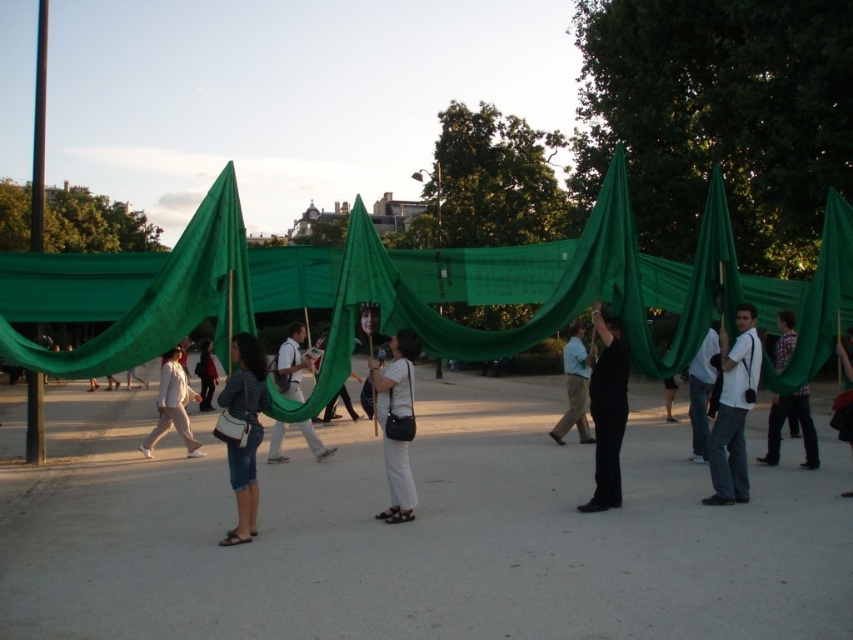
Is point (780, 362) farther from viewer compared to point (675, 420)?

That is False.

Can you confirm if plaid shirt at center is smaller than black fabric at center?

Correct, plaid shirt at center occupies less space than black fabric at center.

Is point (787, 339) more distant than point (671, 374)?

Yes.

Find the location of `plaid shirt at center`. plaid shirt at center is located at coordinates (798, 422).

Is white fabric backpack at center positioned before red fabric at center?

Yes, it is.

From the picture: Does white fabric backpack at center appear over red fabric at center?

Actually, white fabric backpack at center is below red fabric at center.

Measure the distance between point [281,436] and camera.

Point [281,436] and camera are 11.04 meters apart.

At what (x,y) coordinates should I click in order to perform the action: click on white fabric backpack at center. Please return your answer as a coordinate pair (x, y). The image size is (853, 640). Looking at the image, I should click on (291, 364).

Can you confirm if black matte pants at center is wider than white fabric backpack at center?

No, black matte pants at center is not wider than white fabric backpack at center.

Is black matte pants at center above white fabric backpack at center?

Yes.

Find the location of a particular element. black matte pants at center is located at coordinates (607, 410).